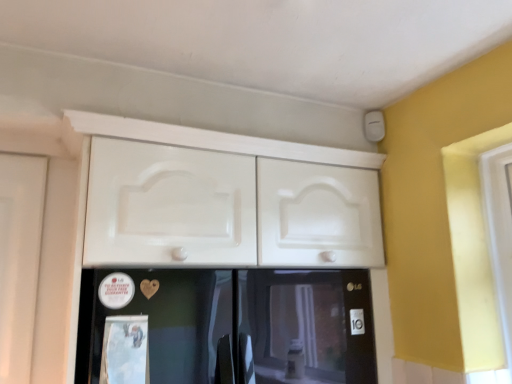
Find the location of a particular element. white glossy cabinet at upper center is located at coordinates (226, 209).

The width and height of the screenshot is (512, 384). What do you see at coordinates (226, 209) in the screenshot?
I see `white glossy cabinet at upper center` at bounding box center [226, 209].

Find the location of a particular element. The image size is (512, 384). white glossy cabinet at upper center is located at coordinates (226, 209).